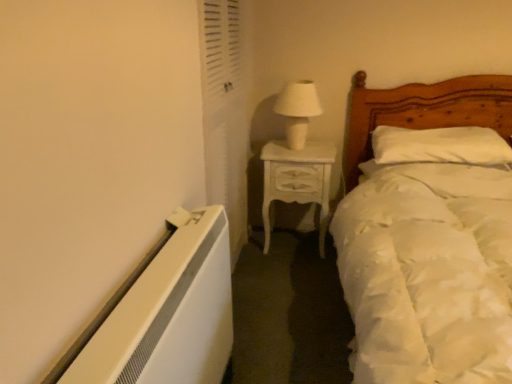
Question: From a real-world perspective, is white satin bed at right beneath white soft pillow at center?

Choices:
 (A) yes
 (B) no

Answer: (A)

Question: Does white satin bed at right have a lesser height compared to white soft pillow at center?

Choices:
 (A) yes
 (B) no

Answer: (B)

Question: Does white satin bed at right have a greater height compared to white soft pillow at center?

Choices:
 (A) no
 (B) yes

Answer: (B)

Question: Would you say white satin bed at right is outside white soft pillow at center?

Choices:
 (A) yes
 (B) no

Answer: (A)

Question: Is white satin bed at right oriented away from white soft pillow at center?

Choices:
 (A) yes
 (B) no

Answer: (A)

Question: From the image's perspective, is white satin bed at right above white soft pillow at center?

Choices:
 (A) no
 (B) yes

Answer: (A)

Question: Is white textured screen door at upper left oriented away from white ceramic table lamp at upper center?

Choices:
 (A) no
 (B) yes

Answer: (A)

Question: Is white textured screen door at upper left next to white ceramic table lamp at upper center?

Choices:
 (A) yes
 (B) no

Answer: (B)

Question: Does white textured screen door at upper left have a greater height compared to white ceramic table lamp at upper center?

Choices:
 (A) yes
 (B) no

Answer: (A)

Question: From a real-world perspective, is white textured screen door at upper left below white ceramic table lamp at upper center?

Choices:
 (A) yes
 (B) no

Answer: (A)

Question: From the image's perspective, is white textured screen door at upper left over white ceramic table lamp at upper center?

Choices:
 (A) yes
 (B) no

Answer: (B)

Question: From a real-world perspective, is white textured screen door at upper left on white ceramic table lamp at upper center?

Choices:
 (A) yes
 (B) no

Answer: (B)

Question: Is white ceramic table lamp at upper center facing away from white satin bed at right?

Choices:
 (A) no
 (B) yes

Answer: (A)